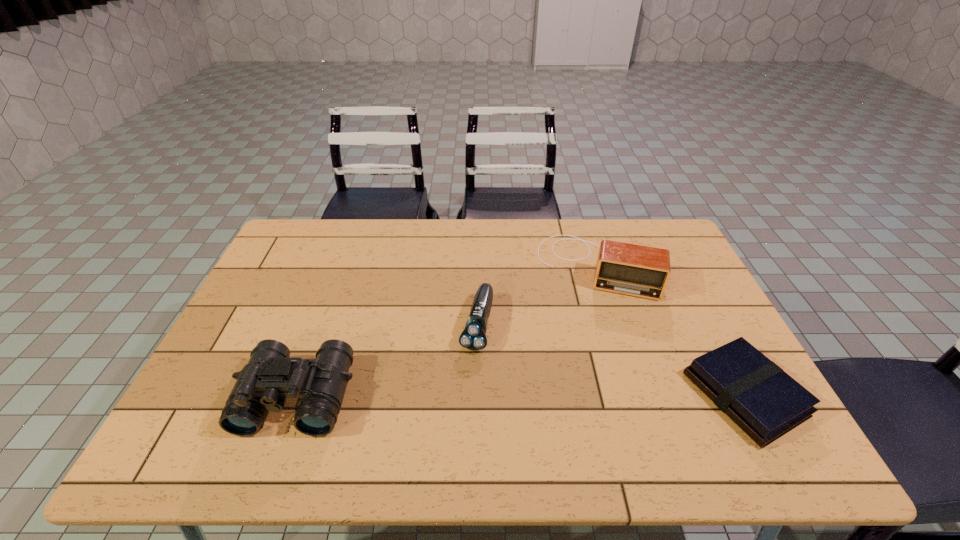
Where is `binoculars`? binoculars is located at coordinates (270, 376).

Locate an element on the screen. the leftmost object is located at coordinates (270, 376).

Identify the location of book. (756, 394).

Locate an element on the screen. radio receiver is located at coordinates (642, 271).

The image size is (960, 540). I want to click on the third tallest object, so click(x=473, y=337).

This screenshot has height=540, width=960. What are the coordinates of `electric shaver` in the screenshot? It's located at (473, 337).

Locate an element on the screen. This screenshot has width=960, height=540. vacant point located on the left of the book is located at coordinates (612, 395).

Where is `vacant space located 0.140m on the front-facing side of the third shortest object`? The height and width of the screenshot is (540, 960). vacant space located 0.140m on the front-facing side of the third shortest object is located at coordinates (586, 335).

Find the location of a particular element. vacant space located on the front-facing side of the third shortest object is located at coordinates (588, 322).

Find the location of a particular element. free region located on the front-facing side of the third shortest object is located at coordinates (586, 335).